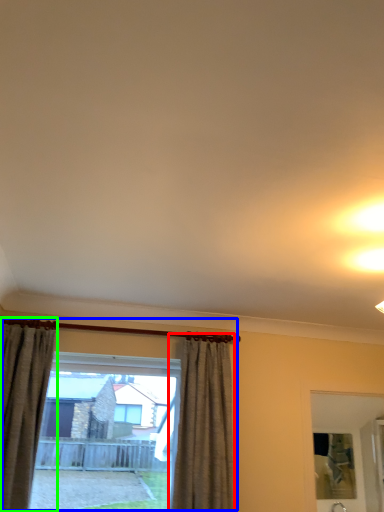
Question: Based on their relative distances, which object is nearer to curtain (highlighted by a red box)? Choose from window (highlighted by a blue box) and curtain (highlighted by a green box).

Choices:
 (A) window
 (B) curtain

Answer: (A)